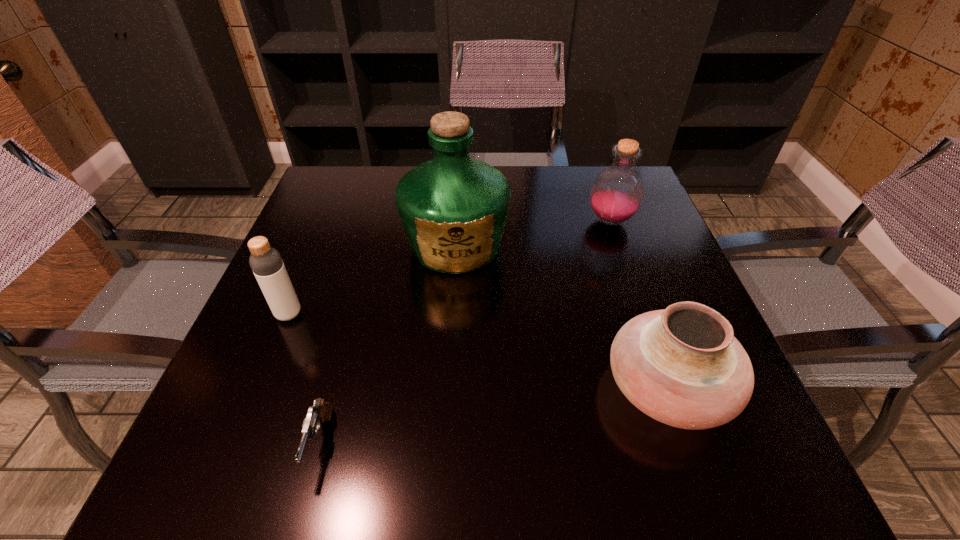
The image size is (960, 540). I want to click on vacant space that satisfies the following two spatial constraints: 1. on the label side of the liquor; 2. on the right side of the pottery, so click(447, 387).